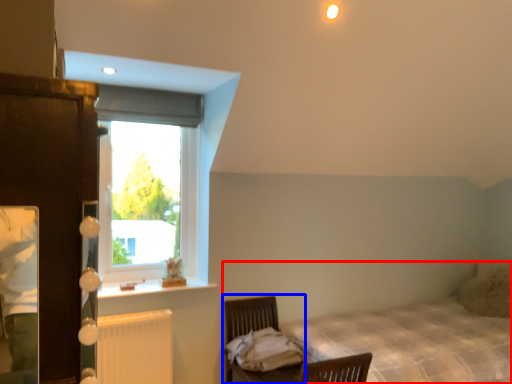
Question: Which of the following is the closest to the observer, bed (highlighted by a red box) or swivel chair (highlighted by a blue box)?

Choices:
 (A) bed
 (B) swivel chair

Answer: (A)